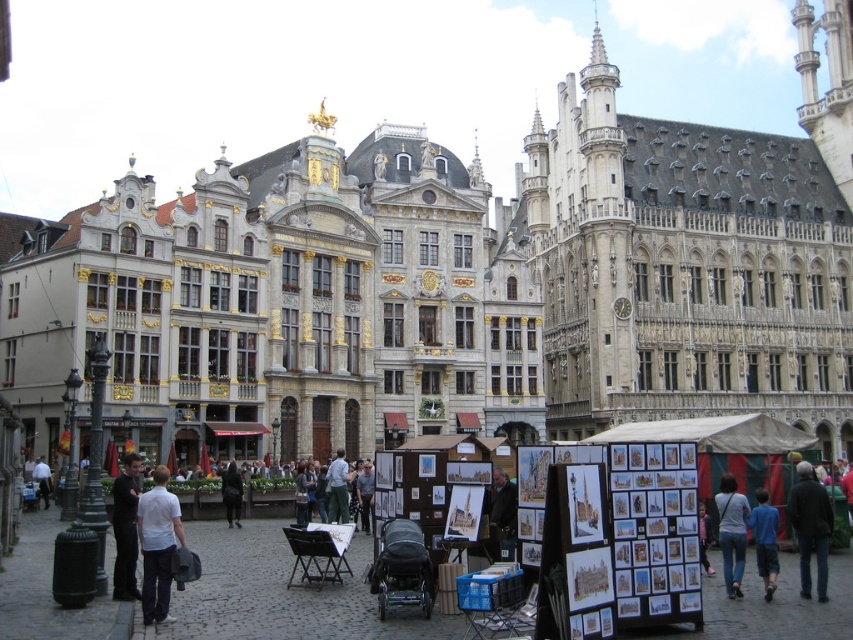
You are a tourist standing at the center of the square and want to reach the dark brown leather jacket at lower right. The square has a fountain in the center that you must walk around. If the fountain has a diameter of 10 meters, what is the shortest distance you need to walk to reach the jacket?

The shortest distance would be the straight line distance minus the detour around the fountain. However, since the fountain is in the center and you must walk around it, the path would require going around the circumference. The circumference is pi multiplied by diameter, so 3.1416 x 10 meters equals approximately 31.4 meters. However, since the jacket is at lower right, you would only need to walk a quarter of the circumference, which is 31.4 divided by 4, approximately 7.85 meters. Adding this to the 37.4

You are standing in the town square and want to take a photo of both the white stone building at center and the white shirt at lower left. Given that your camera can focus on objects within a 50 meter distance, will you be able to capture both subjects clearly in the same photo?

The white stone building at center is 62.83 meters away from the white shirt at lower left. Since the camera can only focus within 50 meters, the distance between them exceeds the camera range. Therefore, you cannot capture both subjects clearly in the same photo.

In the scene shown: You are standing in the historic town square and want to take a photo of the point at coordinates (x=740, y=552). If your camera has a maximum range of 120 feet, will you be able to capture the point in your photo?

The point at coordinates (x=740, y=552) is 126.36 feet away from the camera, which exceeds the camera maximum range of 120 feet. Therefore, you will not be able to capture the point in your photo.